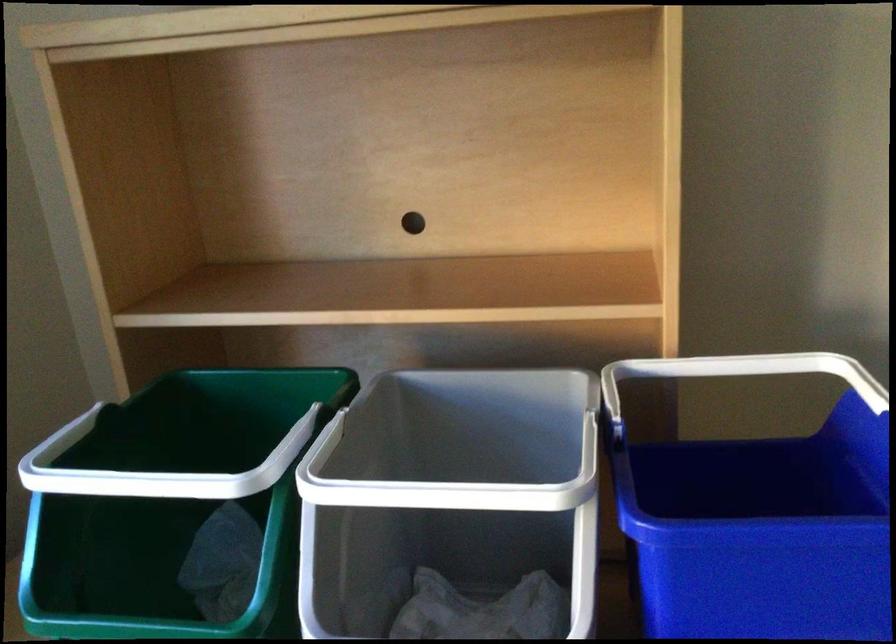
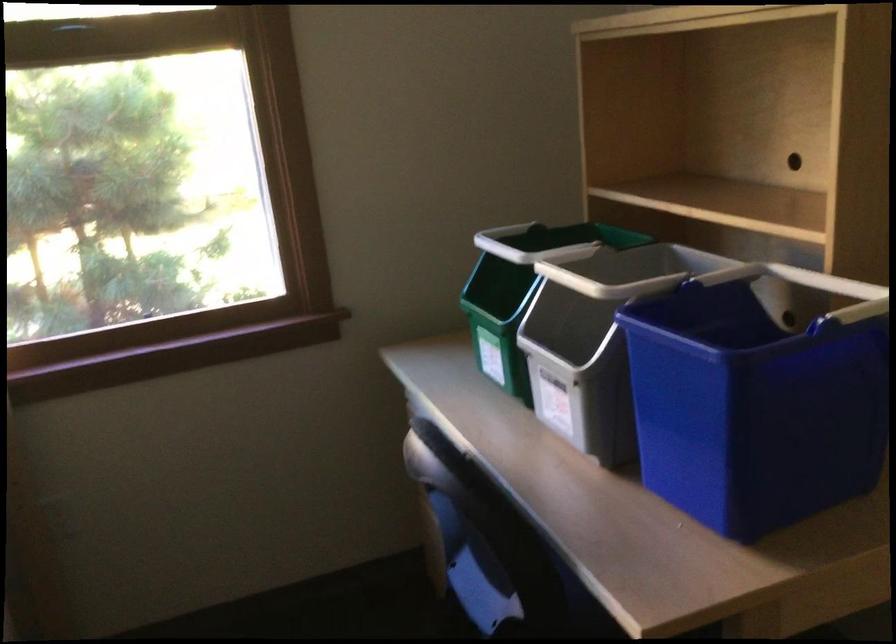
Question: The camera is either moving clockwise (left) or counter-clockwise (right) around the object. The first image is from the beginning of the video and the second image is from the end. Is the camera moving left or right when shooting the video?

Choices:
 (A) Left
 (B) Right

Answer: (B)